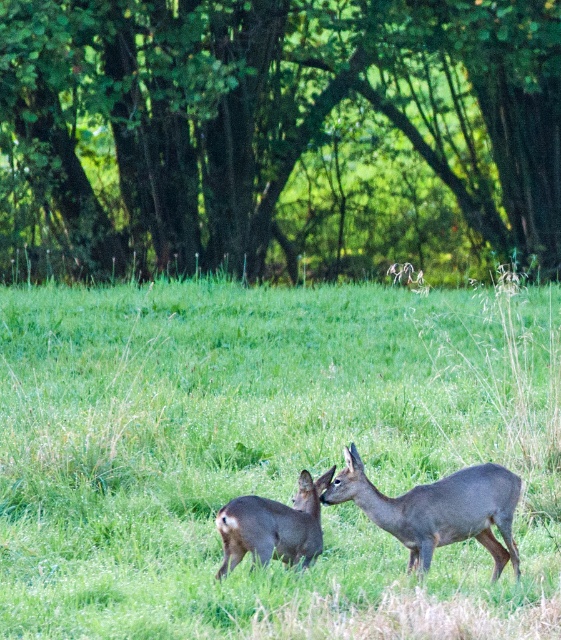
Can you confirm if gray fur deer at center is bigger than gray matte/deer at center?

Yes.

What do you see at coordinates (264, 452) in the screenshot?
I see `gray fur deer at center` at bounding box center [264, 452].

This screenshot has width=561, height=640. Identify the location of gray fur deer at center. (264, 452).

Find the location of `gray fur deer at center`. gray fur deer at center is located at coordinates (264, 452).

Is point (121, 532) positioned behind point (278, 552)?

Yes, it is behind point (278, 552).

Does gray fur deer at center have a lesser width compared to gray matte deer at lower center?

Incorrect, gray fur deer at center's width is not less than gray matte deer at lower center's.

Locate an element on the screen. gray fur deer at center is located at coordinates (264, 452).

You are a GUI agent. You are given a task and a screenshot of the screen. Output one action in this format:
    pyautogui.click(x=<x>, y=<y>)
    Task: Click on the gray fur deer at center
    This screenshot has width=561, height=640.
    Given the screenshot: What is the action you would take?
    pyautogui.click(x=264, y=452)

Does gray matte/deer at center have a greater width compared to gray matte deer at lower center?

Indeed, gray matte/deer at center has a greater width compared to gray matte deer at lower center.

Does gray matte/deer at center have a lesser width compared to gray matte deer at lower center?

In fact, gray matte/deer at center might be wider than gray matte deer at lower center.

Is point (504, 512) closer to camera compared to point (241, 548)?

No.

Where is `gray matte/deer at center`? The height and width of the screenshot is (640, 561). gray matte/deer at center is located at coordinates (438, 509).